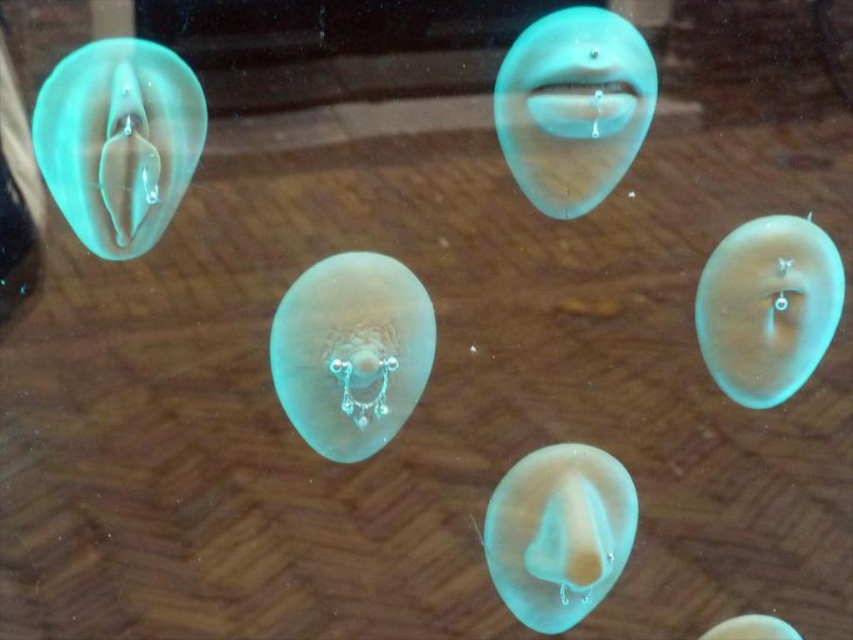
Question: Which object is the closest to the translucent plastic mouth at upper center?

Choices:
 (A) translucent rubber nose at bottom center
 (B) translucent rubber lips at upper center
 (C) translucent plastic jellyfish at center

Answer: (B)

Question: Estimate the real-world distances between objects in this image. Which object is closer to the translucent rubber jellyfish at right?

Choices:
 (A) translucent rubber lips at upper center
 (B) translucent rubber jellyfish at upper left
 (C) translucent rubber nose at bottom center

Answer: (A)

Question: Is translucent rubber jellyfish at right wider than translucent rubber jellyfish at lower right?

Choices:
 (A) yes
 (B) no

Answer: (A)

Question: Can you confirm if translucent plastic jellyfish at center is positioned above translucent rubber nose at bottom center?

Choices:
 (A) no
 (B) yes

Answer: (B)

Question: Which object is farther from the camera taking this photo?

Choices:
 (A) translucent rubber jellyfish at right
 (B) translucent rubber nose at bottom center

Answer: (B)

Question: Does translucent plastic jellyfish at center have a smaller size compared to translucent rubber jellyfish at lower right?

Choices:
 (A) yes
 (B) no

Answer: (B)